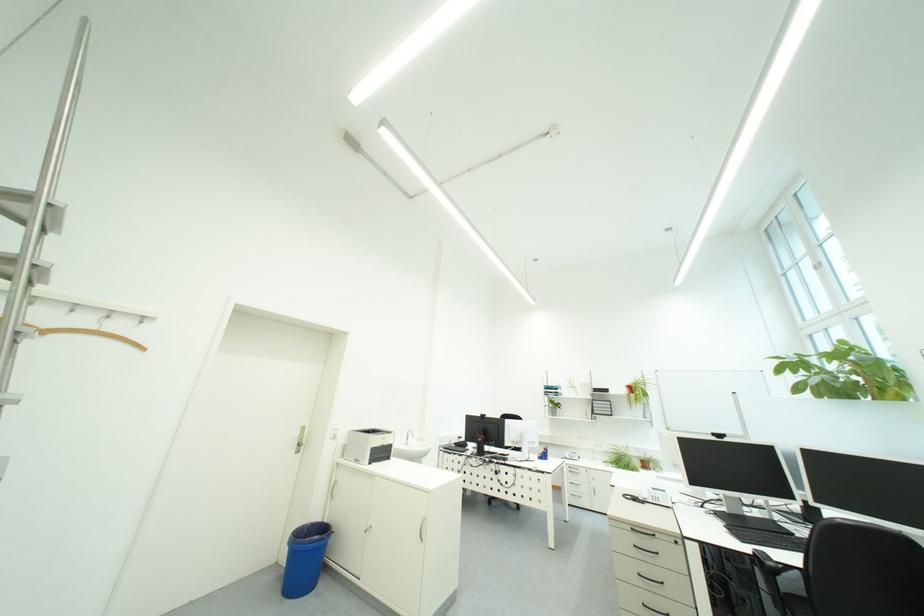
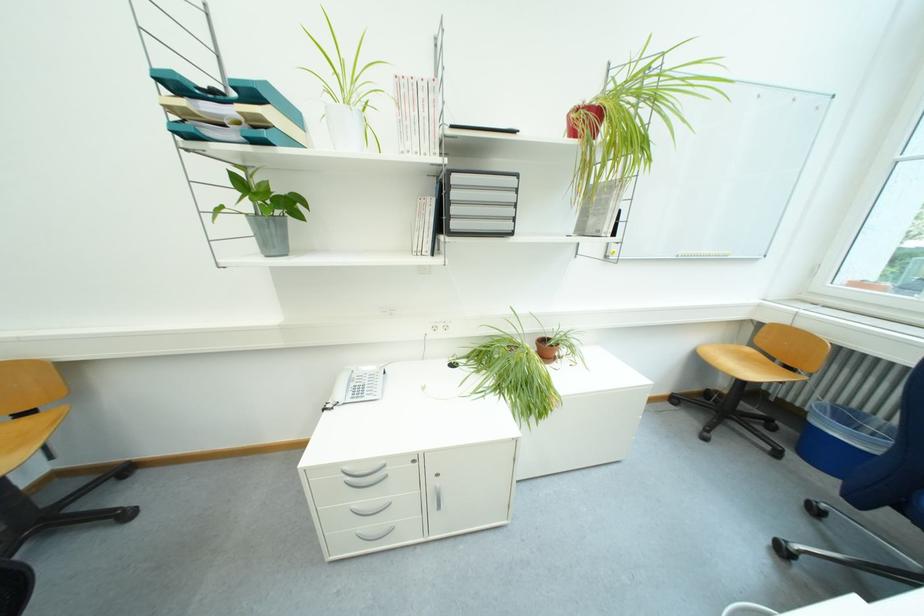
Find the pixel in the second image that matches point 569,407 in the first image.

(302, 206)